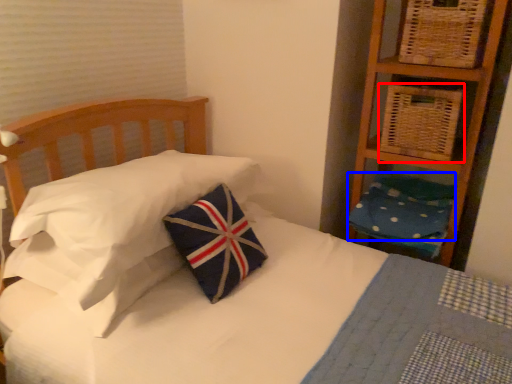
Question: Which point is closer to the camera, basket (highlighted by a red box) or pillow (highlighted by a blue box)?

Choices:
 (A) basket
 (B) pillow

Answer: (A)